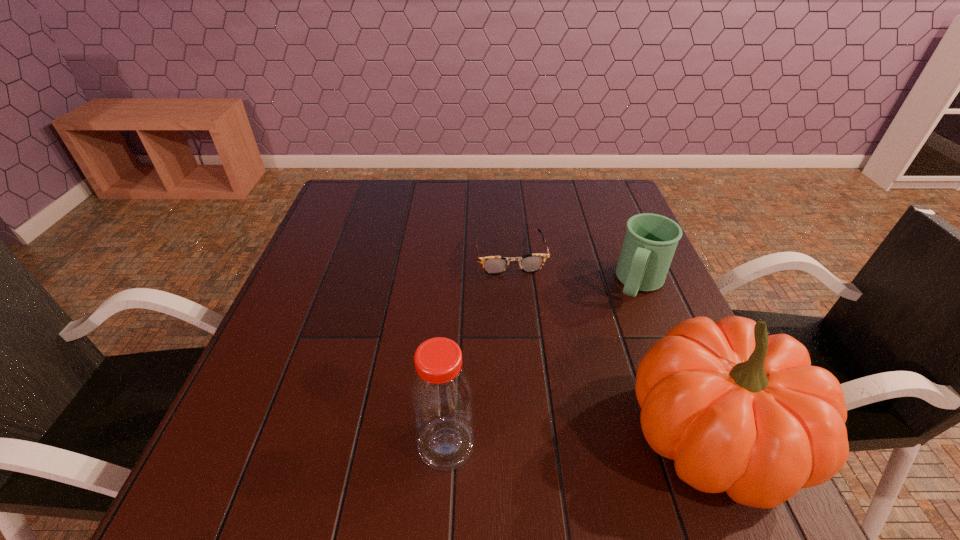
This screenshot has width=960, height=540. I want to click on vacant space on the desktop that is between the bottle and the pumpkin and is positioned on the frame of the shortest object, so click(x=552, y=442).

The image size is (960, 540). Identify the location of vacant space on the desktop that is between the bottle and the pumpkin and is positioned on the side of the mug with the handle. (564, 441).